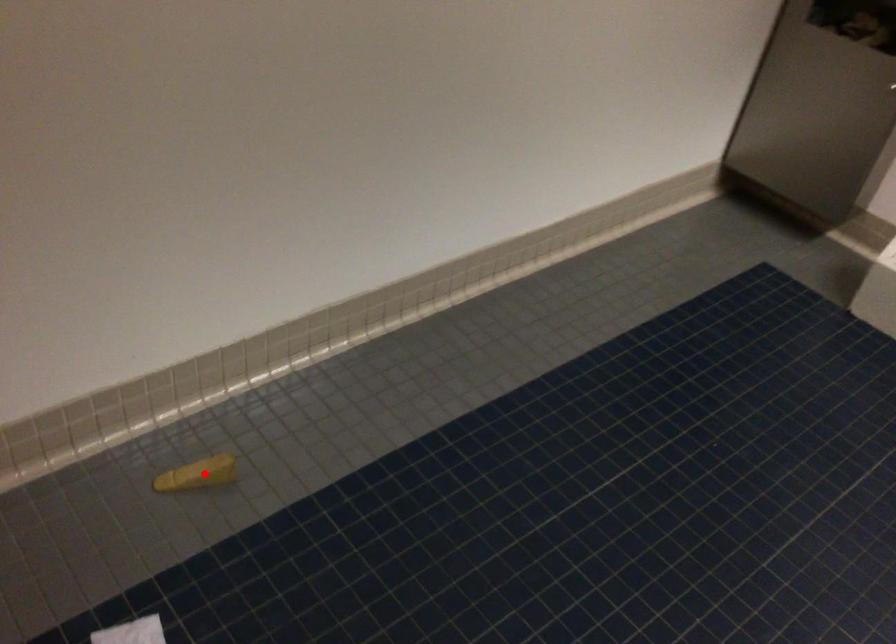
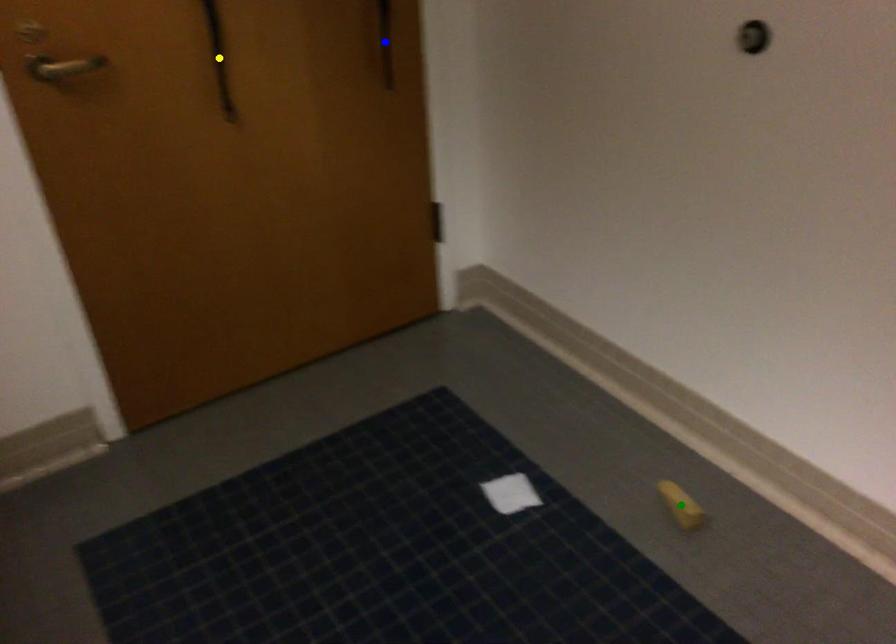
Question: I am providing you with two images of the same scene from different viewpoints. A red point is marked on the first image. You are given multiple points on the second image. Can you choose the point in image 2 that corresponds to the point in image 1?

Choices:
 (A) blue point
 (B) yellow point
 (C) green point

Answer: (C)